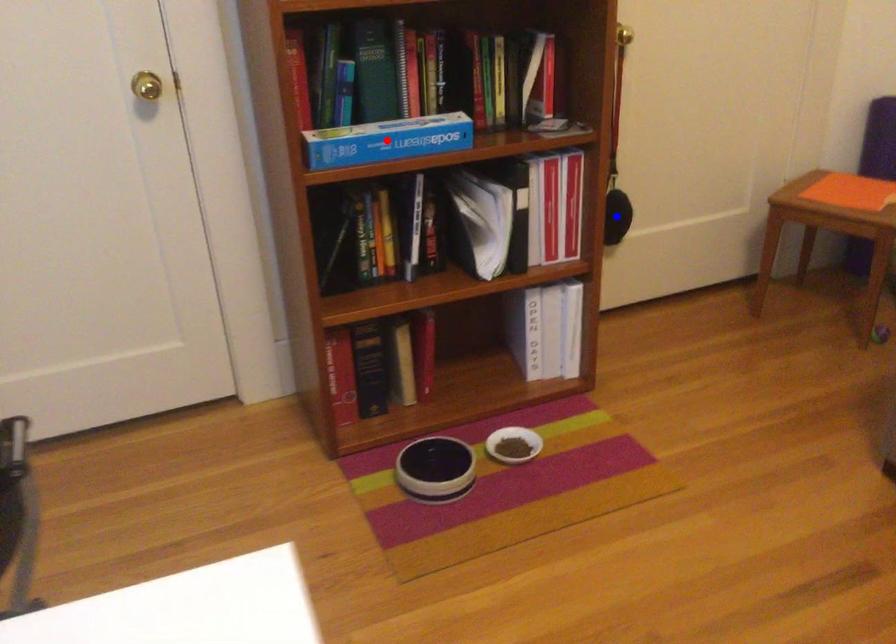
Question: Which of the two points in the image is closer to the camera?

Choices:
 (A) Blue point is closer.
 (B) Red point is closer.

Answer: (B)